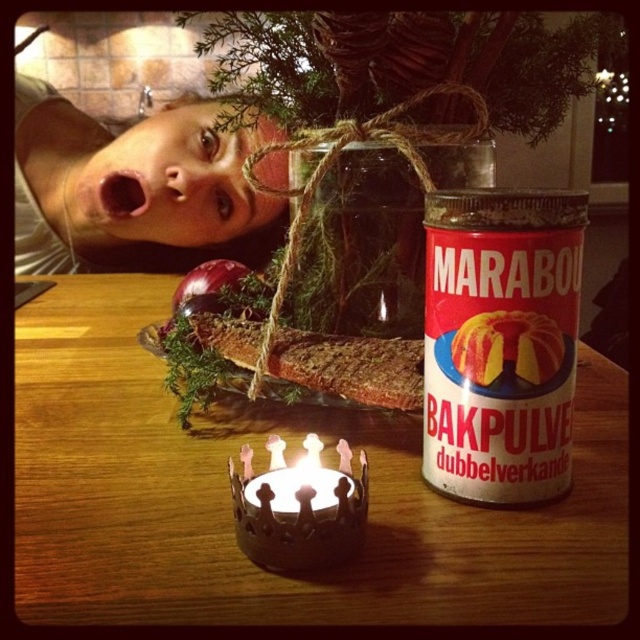
You are a guest at this event and want to place a small gift on the wooden table at center without blocking the matte white face at upper left. Considering their widths, is there enough space on the table to place the gift without covering the face?

The wooden table at center is wider than the matte white face at upper left, so there should be sufficient space to place the gift on the table without covering the face.

You are a guest at a party and see the red matte tin can at right and the matte white face at upper left on the table. Which object is closer to the edge of the table?

The red matte tin can at right is closer to the edge of the table because it is positioned below the matte white face at upper left, indicating it is lower on the table and thus nearer to the edge.